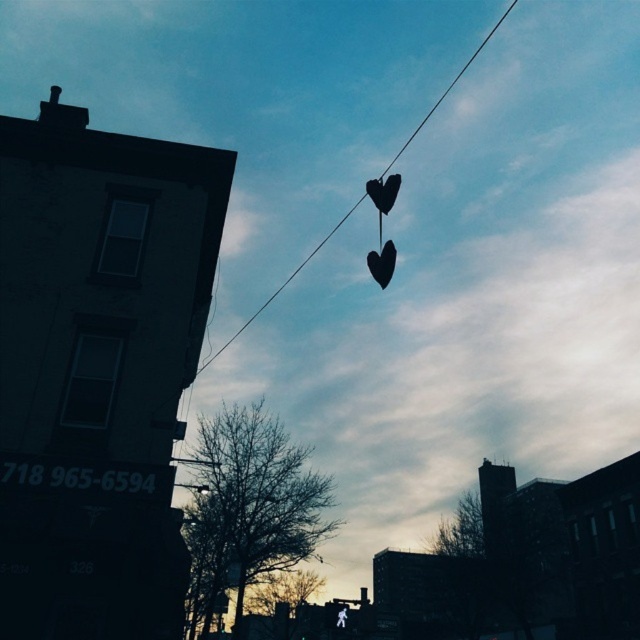
Question: Does black matte heart at center appear on the left side of black matte heart at upper center?

Choices:
 (A) no
 (B) yes

Answer: (A)

Question: Does black matte heart at center appear under black matte heart at upper center?

Choices:
 (A) yes
 (B) no

Answer: (A)

Question: Which point is closer to the camera taking this photo?

Choices:
 (A) pyautogui.click(x=394, y=262)
 (B) pyautogui.click(x=396, y=182)

Answer: (A)

Question: Among these points, which one is nearest to the camera?

Choices:
 (A) (394, 200)
 (B) (371, 269)

Answer: (B)

Question: Is black matte heart at center behind black matte heart at upper center?

Choices:
 (A) no
 (B) yes

Answer: (A)

Question: Which object appears closest to the camera in this image?

Choices:
 (A) black matte heart at center
 (B) black matte heart at upper center

Answer: (A)